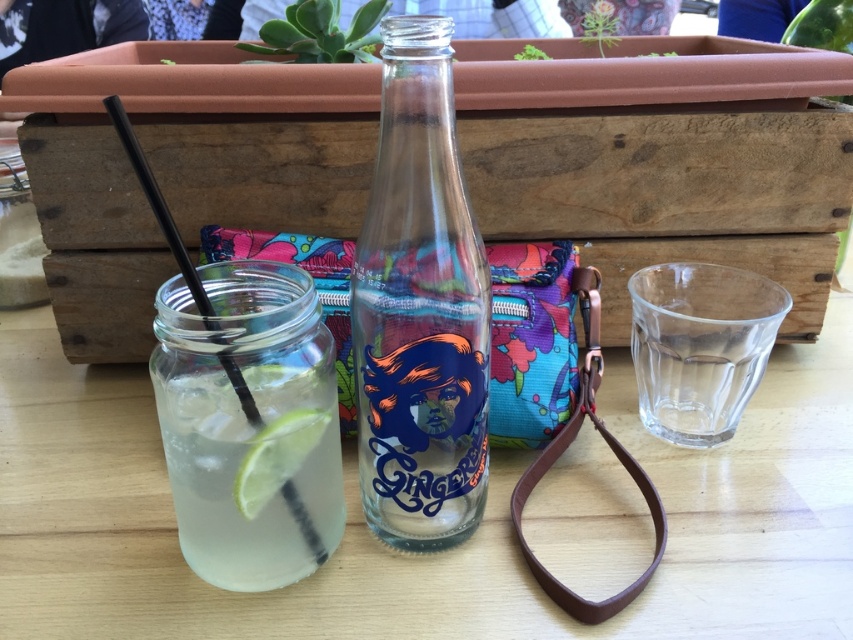
Between point (450, 212) and point (335, 504), which one is positioned in front?

Point (450, 212) is in front.

Does transparent glass bottle at center come in front of clear glass jar at left?

That is True.

Between point (393, 307) and point (292, 352), which one is positioned behind?

The point (292, 352) is behind.

Locate an element on the screen. transparent glass bottle at center is located at coordinates (419, 307).

Locate an element on the screen. brown leather strap at center is located at coordinates (566, 448).

Image resolution: width=853 pixels, height=640 pixels. Describe the element at coordinates (566, 448) in the screenshot. I see `brown leather strap at center` at that location.

Locate an element on the screen. The width and height of the screenshot is (853, 640). brown leather strap at center is located at coordinates (566, 448).

Can you confirm if transparent glass at right is positioned to the right of brown leather strap at center?

Indeed, transparent glass at right is positioned on the right side of brown leather strap at center.

Who is taller, transparent glass at right or brown leather strap at center?

brown leather strap at center is taller.

Find the location of a particular element. The width and height of the screenshot is (853, 640). transparent glass at right is located at coordinates (700, 346).

The image size is (853, 640). Find the location of `transparent glass at right`. transparent glass at right is located at coordinates (700, 346).